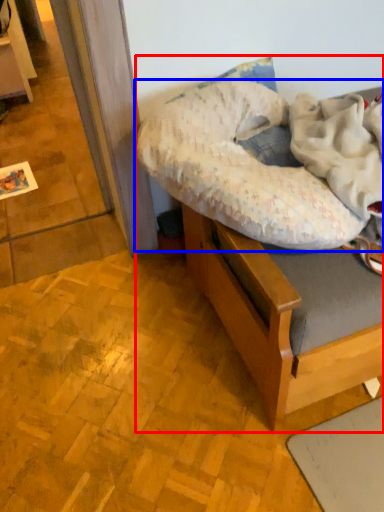
Question: Among these objects, which one is farthest to the camera, hospital bed (highlighted by a red box) or pillow (highlighted by a blue box)?

Choices:
 (A) hospital bed
 (B) pillow

Answer: (A)